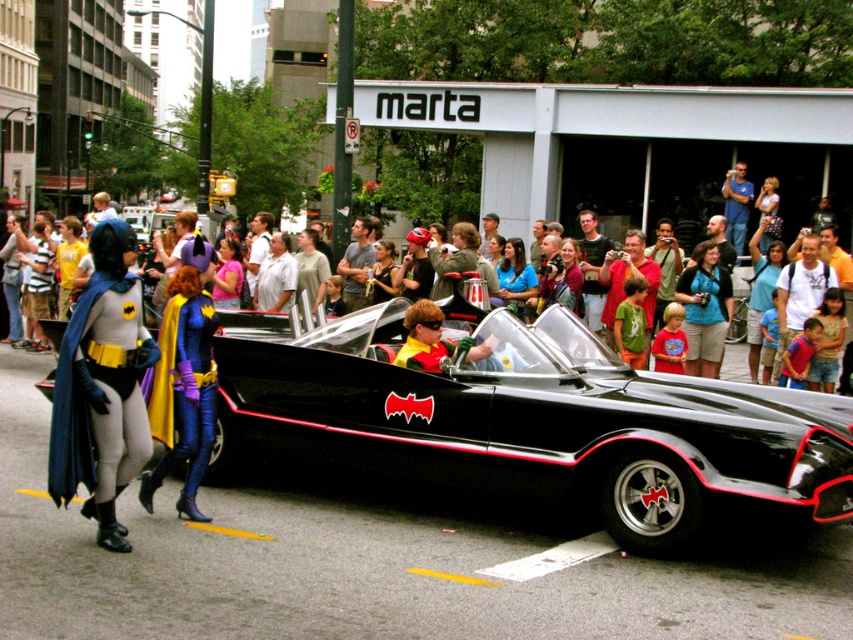
Does point (68, 433) lie behind point (410, 307)?

No, (68, 433) is closer to viewer.

Who is taller, smooth gray bodysuit at left or shiny red and yellow costume at center?

Result: With more height is smooth gray bodysuit at left.

Consider the image. Who is more forward, (102,435) or (412,339)?

Point (102,435) is in front.

Locate an element on the screen. The width and height of the screenshot is (853, 640). smooth gray bodysuit at left is located at coordinates (102, 387).

Between black glossy batmobile at center and shiny purple fabric cape at center, which one is positioned higher?

black glossy batmobile at center is above.

Does black glossy batmobile at center have a greater width compared to shiny purple fabric cape at center?

Correct, the width of black glossy batmobile at center exceeds that of shiny purple fabric cape at center.

Between point (579, 483) and point (177, 458), which one is positioned behind?

Point (177, 458)

Image resolution: width=853 pixels, height=640 pixels. I want to click on black glossy batmobile at center, so click(x=532, y=422).

What do you see at coordinates (553, 173) in the screenshot?
I see `matte black car at center` at bounding box center [553, 173].

Does matte black car at center appear on the left side of shiny red and yellow costume at center?

In fact, matte black car at center is to the right of shiny red and yellow costume at center.

You are a GUI agent. You are given a task and a screenshot of the screen. Output one action in this format:
    pyautogui.click(x=<x>, y=<y>)
    Task: Click on the matte black car at center
    The width and height of the screenshot is (853, 640).
    Given the screenshot: What is the action you would take?
    pyautogui.click(x=553, y=173)